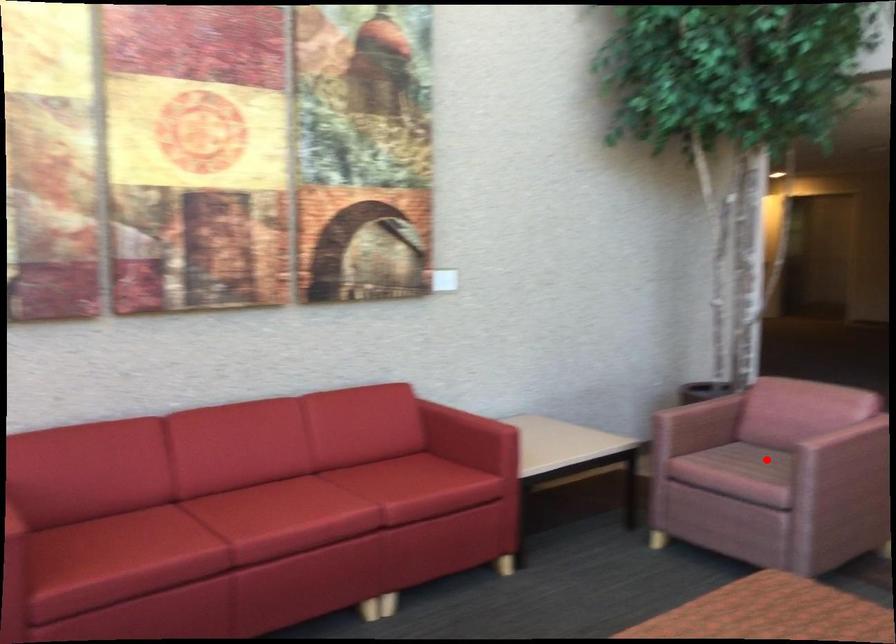
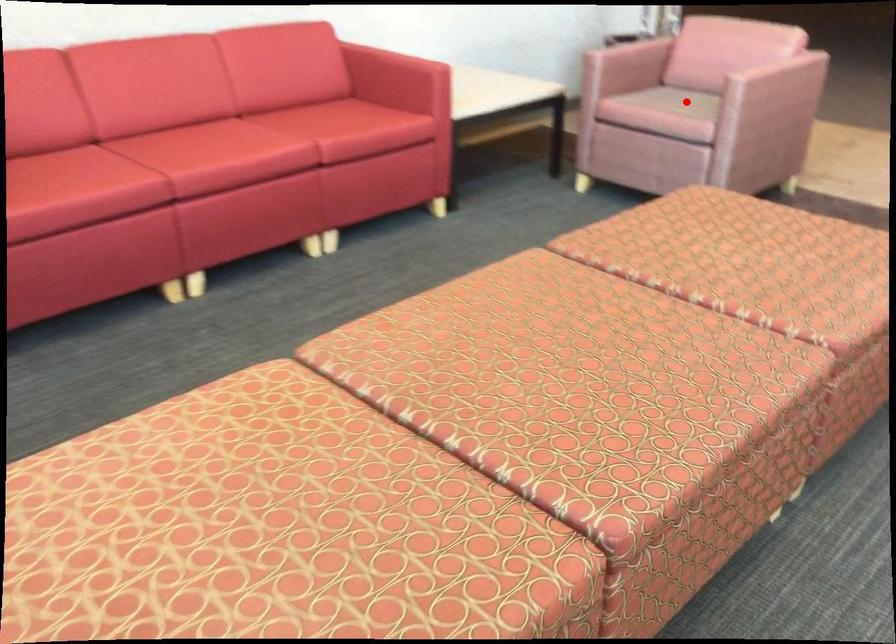
I am providing you with two images of the same scene from different viewpoints. A red point is marked on the first image and another point is marked on the second image. Does the point marked in image1 correspond to the same location as the one in image2?

Yes